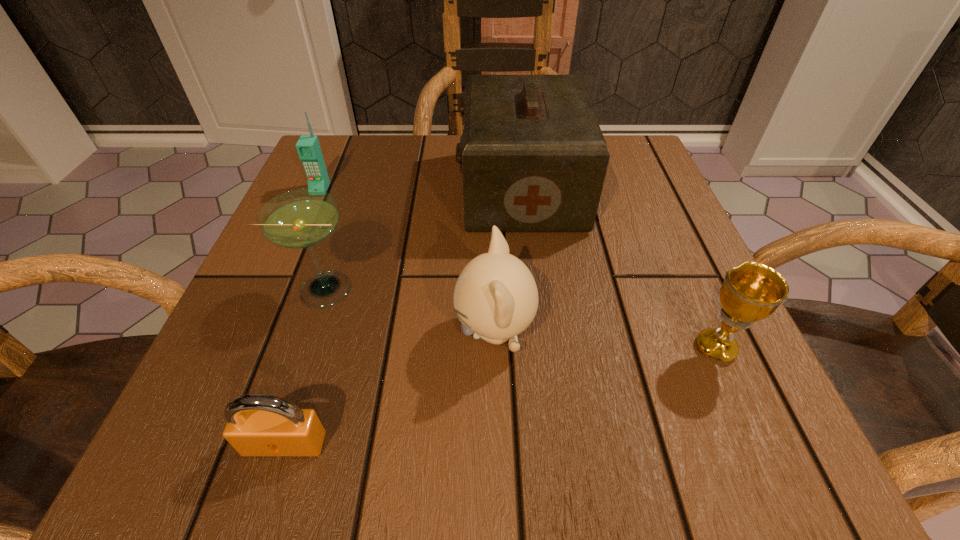
The width and height of the screenshot is (960, 540). What are the coordinates of `vacant area situated 0.080m on the face of the kitten` in the screenshot? It's located at (400, 332).

Find the location of a particular element. free spot located 0.210m on the face of the kitten is located at coordinates (312, 332).

You are a GUI agent. You are given a task and a screenshot of the screen. Output one action in this format:
    pyautogui.click(x=<x>, y=<y>)
    Task: Click on the free space located 0.110m on the face of the kitten
    
    Given the screenshot: What is the action you would take?
    pyautogui.click(x=380, y=332)

Locate an element on the screen. This screenshot has width=960, height=540. free point located 0.120m on the back of the rightmost object is located at coordinates point(682,271).

You are a GUI agent. You are given a task and a screenshot of the screen. Output one action in this format:
    pyautogui.click(x=<x>, y=<y>)
    Task: Click on the first-aid kit present at the far edge
    The image size is (960, 540).
    Given the screenshot: What is the action you would take?
    pyautogui.click(x=533, y=157)

What are the coordinates of `cellular telephone present at the far edge` in the screenshot? It's located at (308, 147).

Find the location of `object present at the near edge`. object present at the near edge is located at coordinates coord(257,424).

Identify the location of martini located at the left edge. This screenshot has height=540, width=960. (302, 218).

Locate an element on the screen. Image resolution: width=960 pixels, height=540 pixels. cellular telephone present at the left edge is located at coordinates (308, 147).

Identify the location of padlock located in the left edge section of the desktop. pos(257,424).